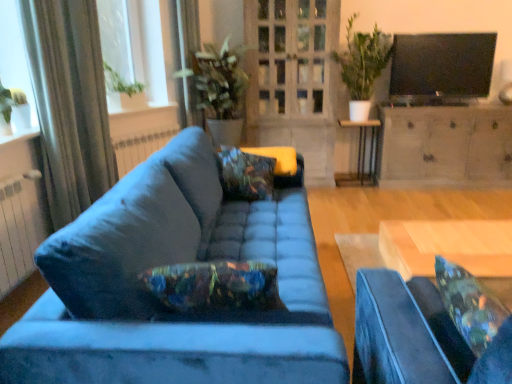
Question: Would you say green leafy plant at upper center, which appears as the second houseplant when viewed from the left, is to the left or to the right of black metal side table at center in the picture?

Choices:
 (A) right
 (B) left

Answer: (B)

Question: Looking at their shapes, would you say green leafy plant at upper center, which appears as the second houseplant when viewed from the left, is wider or thinner than black metal side table at center?

Choices:
 (A) thin
 (B) wide

Answer: (B)

Question: Estimate the real-world distances between objects in this image. Which object is closer to the green leafy plant at upper center, the 2th houseplant when ordered from right to left?

Choices:
 (A) clear glass door at center
 (B) green leafy plant at upper left
 (C) green fabric curtain at upper left, the 2th curtain from the front
 (D) velvet blue studio couch at center, the second studio couch from the left
 (E) matte white radiator at left, which appears as the 1th radiator when viewed from the right

Answer: (C)

Question: Considering the real-world distances, which object is closest to the white metallic radiator at lower left, the 1th radiator positioned from the bottom?

Choices:
 (A) velvet blue studio couch at center, which appears as the first studio couch when viewed from the right
 (B) black metal side table at center
 (C) black glossy tv at upper right
 (D) transparent glass window screen at upper left
 (E) matte gray cabinet at center right

Answer: (D)